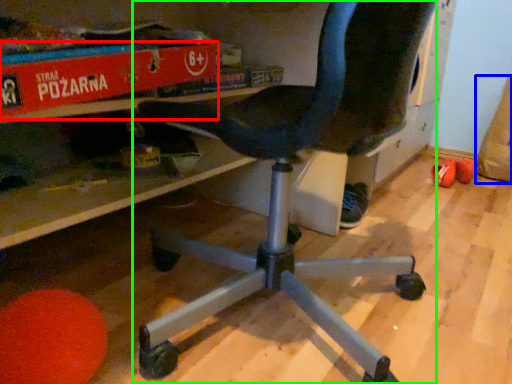
Question: Estimate the real-world distances between objects in this image. Which object is farther from paperback book (highlighted by a red box), bean bag chair (highlighted by a blue box) or chair (highlighted by a green box)?

Choices:
 (A) bean bag chair
 (B) chair

Answer: (A)